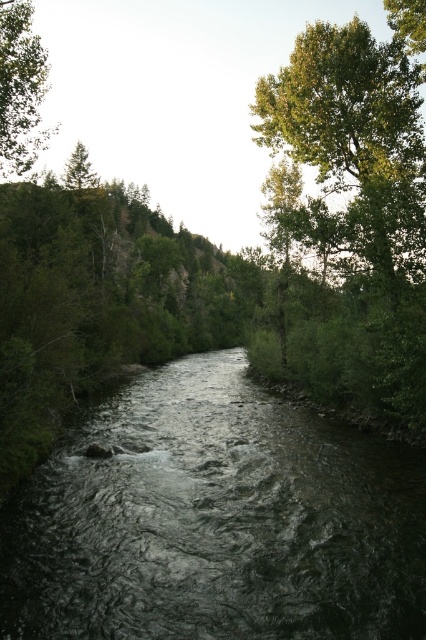
Question: Which point appears closest to the camera in this image?

Choices:
 (A) (5, 92)
 (B) (199, 378)
 (C) (299, 38)
 (D) (66, 186)

Answer: (A)

Question: Can you confirm if dark gray water at center is smaller than green matte tree at upper left?

Choices:
 (A) yes
 (B) no

Answer: (A)

Question: Where is green leafy tree at upper right located in relation to green leafy tree at upper left in the image?

Choices:
 (A) right
 (B) left

Answer: (A)

Question: Can you confirm if green leafy tree at upper right is wider than green leafy tree at upper left?

Choices:
 (A) no
 (B) yes

Answer: (A)

Question: Estimate the real-world distances between objects in this image. Which object is closer to the green leafy tree at upper left?

Choices:
 (A) dark gray water at center
 (B) green leafy tree at upper right

Answer: (A)

Question: Which point is farther to the camera?

Choices:
 (A) (75, 168)
 (B) (256, 600)

Answer: (A)